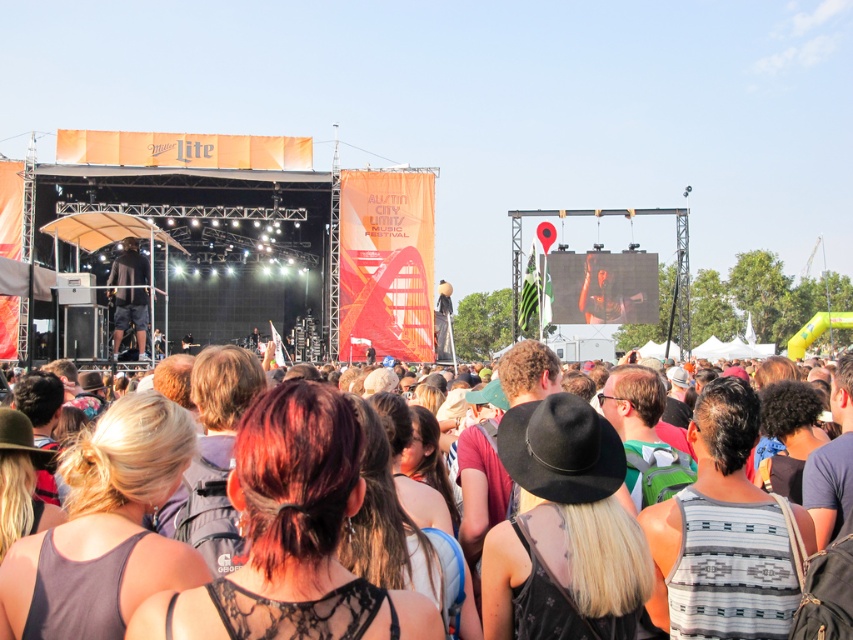
You are a photographer at the Austin City Limits Music Festival. You want to capture a photo of the black matte shirt at center and the multicolored fabric crowd at center. From your current position, which object is positioned to the right?

The multicolored fabric crowd at center is positioned to the right of the black matte shirt at center.

You are a photographer at the Austin City Limits Music Festival. You want to capture a photo that includes both the multicolored fabric crowd at center and the black matte shirt at center. Which object should you zoom in on to ensure both are fully visible in the frame?

The multicolored fabric crowd at center is wider than the black matte shirt at center, so you should zoom in on the multicolored fabric crowd at center to ensure both are fully visible in the frame.

You are a photographer at the Austin City Limits Music Festival. You want to take a photo of the black matte shirt at center without the multicolored fabric crowd at center blocking it. Is this possible from your current position?

The multicolored fabric crowd at center is in front of the black matte shirt at center, so it will block the view. Move to a different position where the black matte shirt at center is not obscured by the crowd.